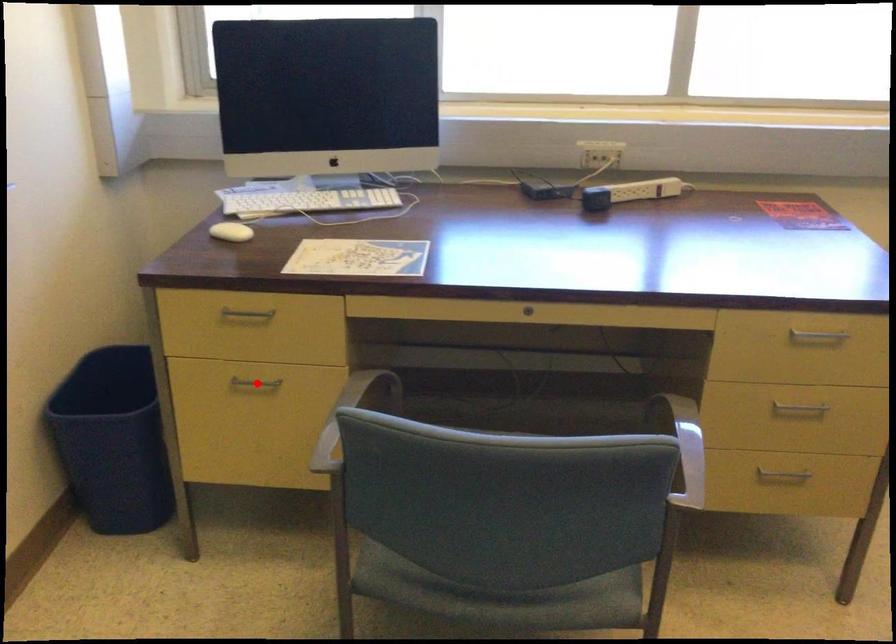
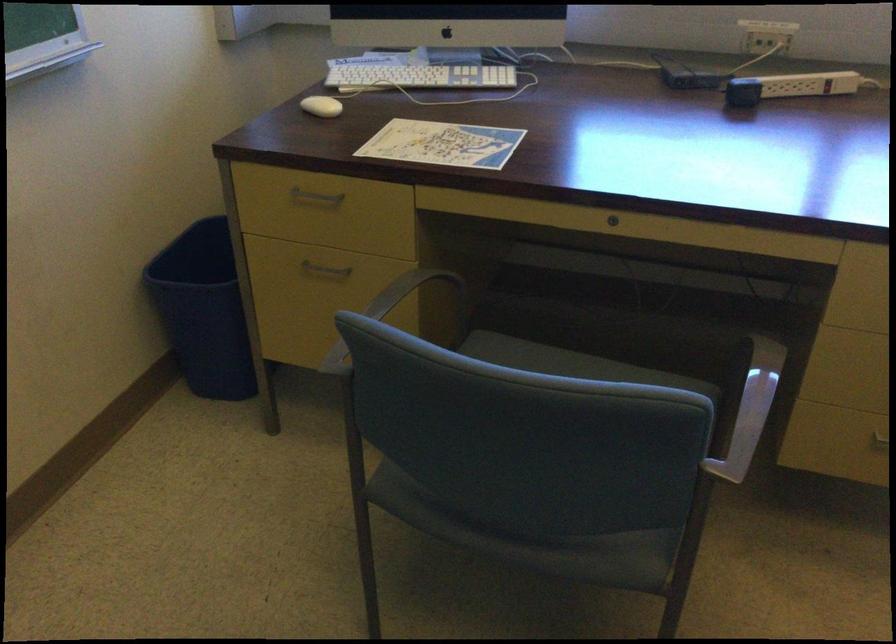
The point at the highlighted location is marked in the first image. Where is the corresponding point in the second image?

(324, 269)